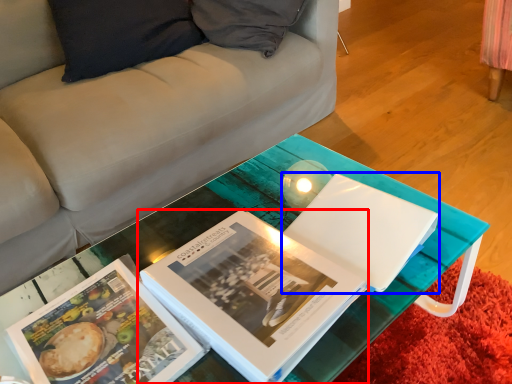
Question: Which point is further to the camera, book (highlighted by a red box) or paperback book (highlighted by a blue box)?

Choices:
 (A) book
 (B) paperback book

Answer: (B)